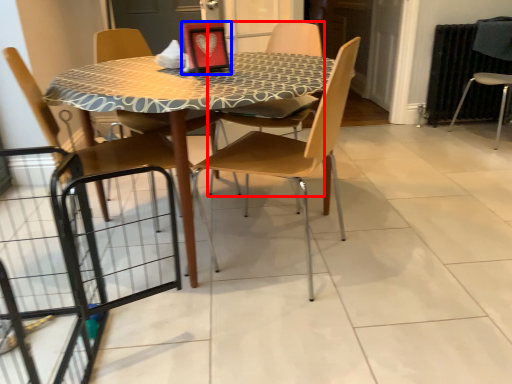
Question: Which object appears farthest to the camera in this image, chair (highlighted by a red box) or picture frame (highlighted by a blue box)?

Choices:
 (A) chair
 (B) picture frame

Answer: (A)